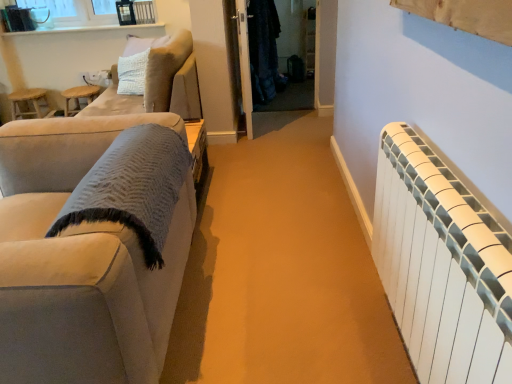
Question: From a real-world perspective, is dark matte coat at center above or below white plastic radiator at right?

Choices:
 (A) above
 (B) below

Answer: (A)

Question: In the image, is dark matte coat at center on the left side or the right side of white plastic radiator at right?

Choices:
 (A) right
 (B) left

Answer: (B)

Question: Which object is positioned farthest from the white plastic radiator at right?

Choices:
 (A) wooden stool at left
 (B) wooden stool at left
 (C) suede-like beige couch at left, which is the second studio couch in back-to-front order
 (D) white glossy window sill at upper left
 (E) suede-like beige couch at upper left, the 1th studio couch viewed from the back

Answer: (B)

Question: Which is nearer to the white glossy window sill at upper left?

Choices:
 (A) wooden stool at left
 (B) white glossy door at center
 (C) suede-like beige couch at left, which is the second studio couch in back-to-front order
 (D) dark matte coat at center
 (E) white plastic radiator at right

Answer: (A)